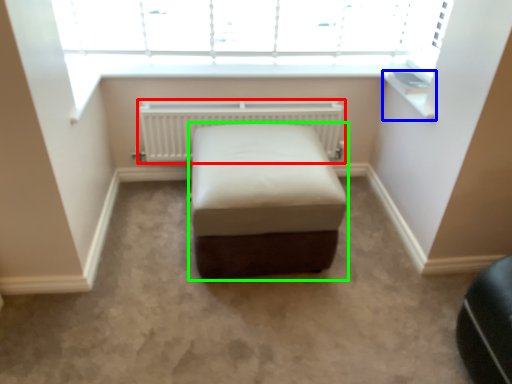
Question: Which is farther away from radiator (highlighted by a red box)? window sill (highlighted by a blue box) or furniture (highlighted by a green box)?

Choices:
 (A) window sill
 (B) furniture

Answer: (A)